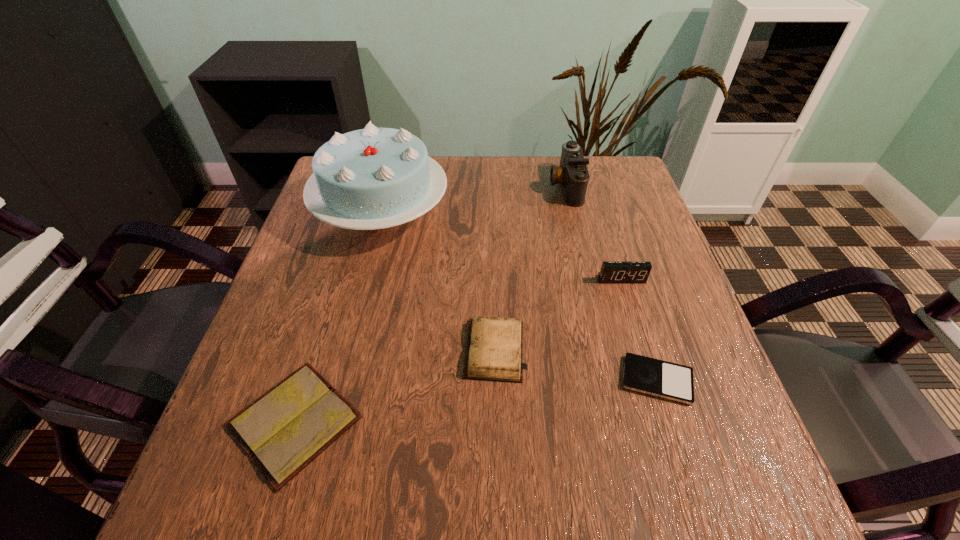
Where is `free space between the shorter diary and the iPod`? free space between the shorter diary and the iPod is located at coordinates (476, 401).

This screenshot has height=540, width=960. Identify the location of free spot between the shorter diary and the alarm clock. (458, 350).

Where is `object that stands as the second closest to the third shortest object`? The height and width of the screenshot is (540, 960). object that stands as the second closest to the third shortest object is located at coordinates (655, 377).

Image resolution: width=960 pixels, height=540 pixels. What are the coordinates of `object that ranks as the second closest to the fifth shortest object` in the screenshot? It's located at (373, 178).

Identify the location of vacant region that satisfies the following two spatial constraints: 1. on the back side of the second shortest object; 2. on the right side of the iPod. This screenshot has width=960, height=540. (307, 380).

I want to click on free space that satisfies the following two spatial constraints: 1. on the front side of the shortest object; 2. on the left side of the right diary, so click(495, 380).

Where is `vacant space that satisfies the following two spatial constraints: 1. on the back side of the third shortest object; 2. on the right side of the left diary`? The height and width of the screenshot is (540, 960). vacant space that satisfies the following two spatial constraints: 1. on the back side of the third shortest object; 2. on the right side of the left diary is located at coordinates point(317,350).

The image size is (960, 540). Identify the location of free location that satisfies the following two spatial constraints: 1. on the front-facing side of the alarm clock; 2. on the right side of the iPod. (653, 380).